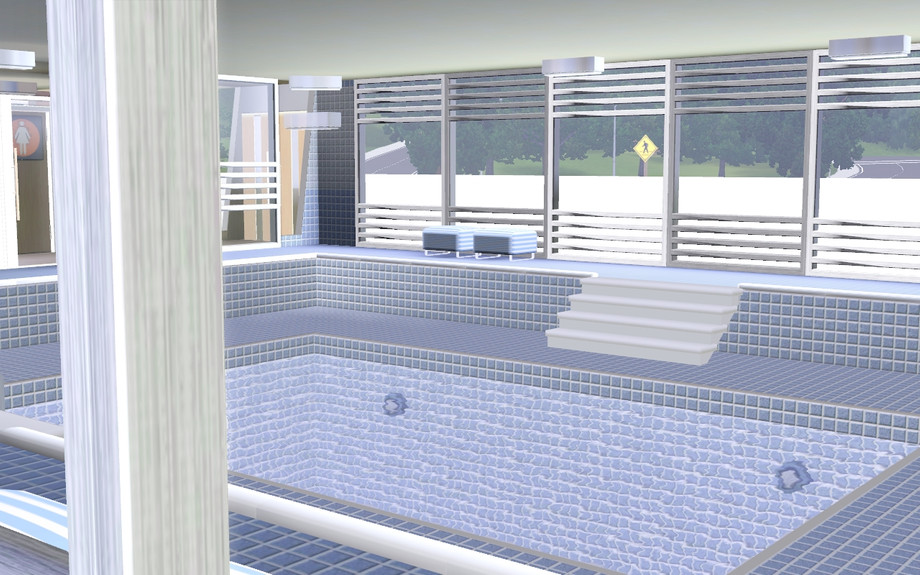
At what (x,y) coordinates should I click in order to perform the action: click on ladies room sign. Please return your answer as a coordinate pair (x, y). This screenshot has height=575, width=920. Looking at the image, I should click on (26, 140).